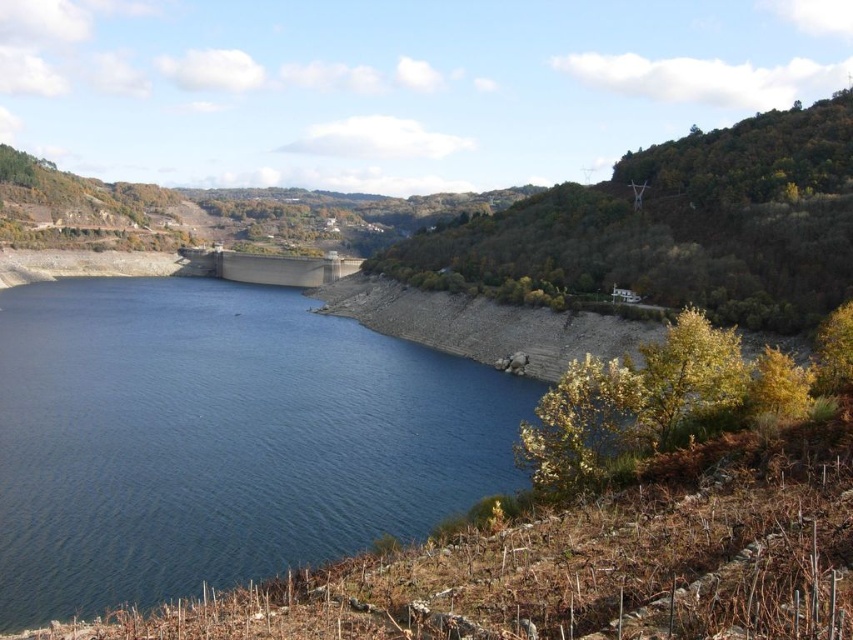
Consider the image. You are a surveyor measuring the elevation of the blue water at center and the gray concrete dam at center in the image. Which one has a higher elevation?

The gray concrete dam at center has a higher elevation than the blue water at center because the blue water at center is shorter than the gray concrete dam at center.